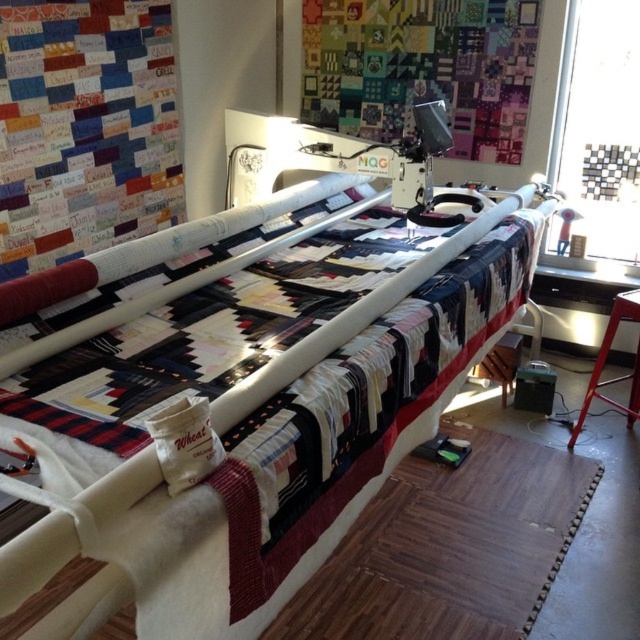
Question: From the image, what is the correct spatial relationship of white quilted bed at center in relation to metallic red stool at lower right?

Choices:
 (A) above
 (B) below

Answer: (A)

Question: Which object appears farthest from the camera in this image?

Choices:
 (A) white quilted bed at center
 (B) metallic red stool at lower right

Answer: (B)

Question: Where is white quilted bed at center located in relation to metallic red stool at lower right in the image?

Choices:
 (A) right
 (B) left

Answer: (B)

Question: Among these points, which one is nearest to the camera?

Choices:
 (A) (570, 435)
 (B) (225, 429)

Answer: (B)

Question: Which point is farther from the camera taking this photo?

Choices:
 (A) (595, 387)
 (B) (221, 593)

Answer: (A)

Question: Can you confirm if white quilted bed at center is positioned to the left of metallic red stool at lower right?

Choices:
 (A) yes
 (B) no

Answer: (A)